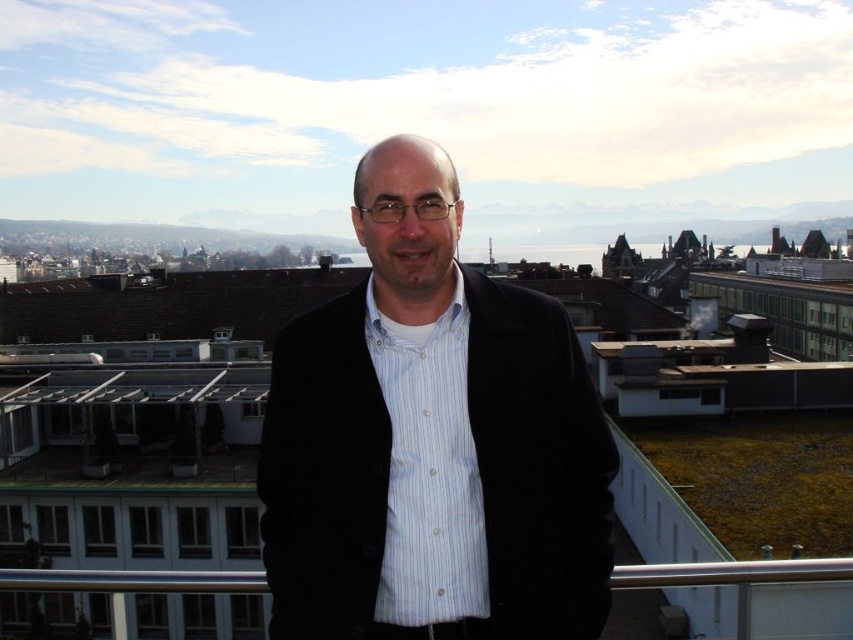
Question: Is black matte jacket at center to the right of silver metallic rail at lower center from the viewer's perspective?

Choices:
 (A) yes
 (B) no

Answer: (A)

Question: Which point is closer to the camera?

Choices:
 (A) (755, 580)
 (B) (399, 396)
 (C) (363, 195)

Answer: (A)

Question: Is black matte jacket at center below white striped shirt at center?

Choices:
 (A) yes
 (B) no

Answer: (B)

Question: Which point is farther to the camera?

Choices:
 (A) white striped shirt at center
 (B) black matte jacket at center

Answer: (A)

Question: Considering the real-world distances, which object is closest to the white striped shirt at center?

Choices:
 (A) silver metallic rail at lower center
 (B) black matte jacket at center

Answer: (B)

Question: Can you confirm if black matte jacket at center is bigger than white striped shirt at center?

Choices:
 (A) no
 (B) yes

Answer: (B)